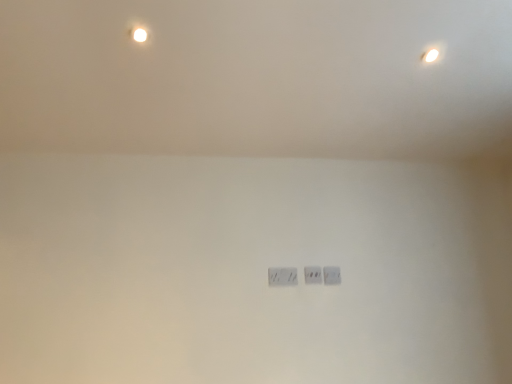
Question: Visually, is white plastic power plugs and sockets at center, which is counted as the first power plugs and sockets, starting from the left, positioned to the left or to the right of white plastic power plugs and sockets at center, the first power plugs and sockets positioned from the right?

Choices:
 (A) left
 (B) right

Answer: (A)

Question: In terms of height, does white plastic power plugs and sockets at center, which is counted as the first power plugs and sockets, starting from the left, look taller or shorter compared to white plastic power plugs and sockets at center, placed as the third power plugs and sockets when sorted from left to right?

Choices:
 (A) tall
 (B) short

Answer: (A)

Question: Which is nearer to the white plastic power plugs and sockets at center, placed as the third power plugs and sockets when sorted from left to right?

Choices:
 (A) white plastic power plugs and sockets at center, which is counted as the first power plugs and sockets, starting from the left
 (B) matte white light bulb at upper left
 (C) white plastic power plugs and sockets at center, which is the second power plugs and sockets in left-to-right order

Answer: (C)

Question: Which is nearer to the white plastic power plugs and sockets at center, which is counted as the first power plugs and sockets, starting from the left?

Choices:
 (A) matte white light bulb at upper left
 (B) white plastic power plugs and sockets at center, placed as the third power plugs and sockets when sorted from left to right
 (C) white plastic power plugs and sockets at center, which ranks as the 2th power plugs and sockets in right-to-left order

Answer: (C)